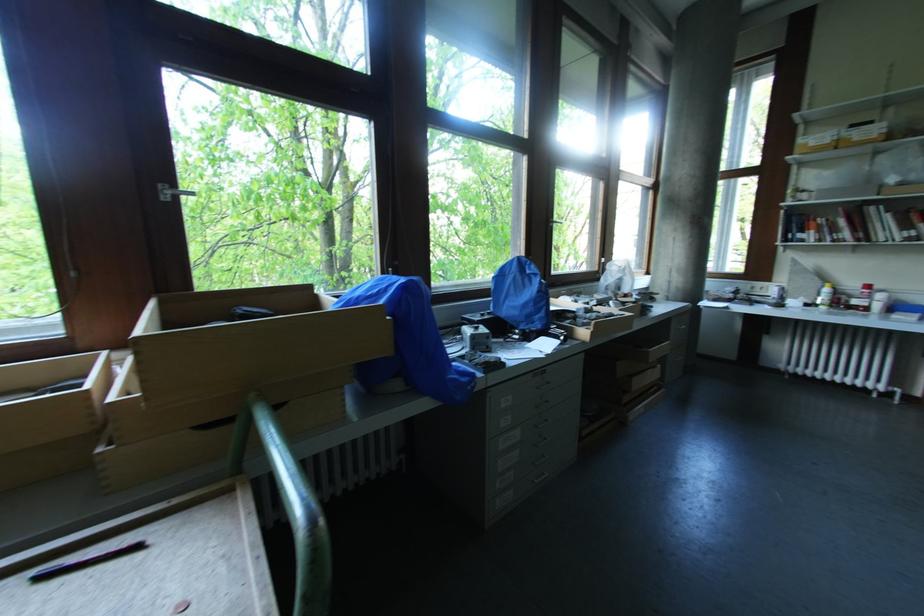
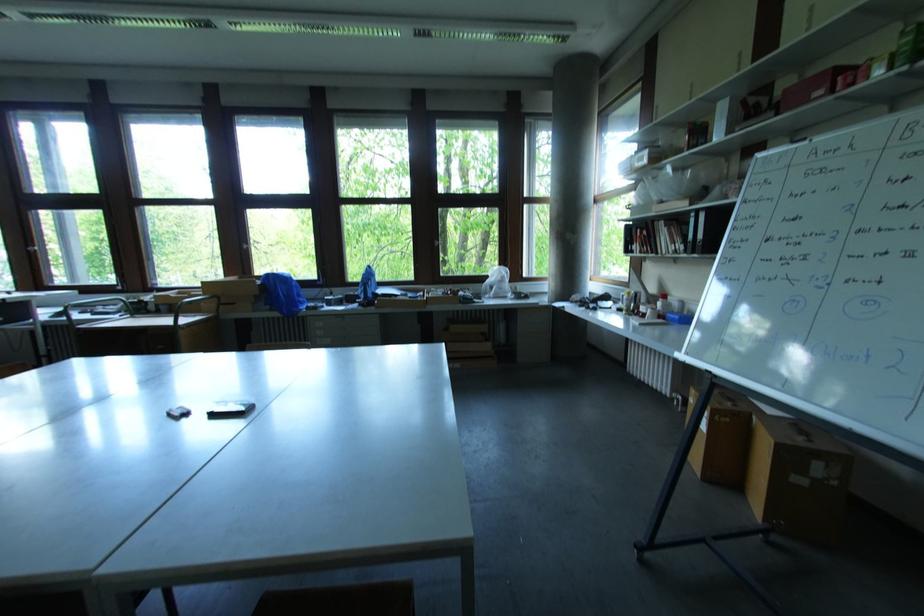
In the second image, find the point that corresponds to point 871,288 in the first image.

(667, 298)